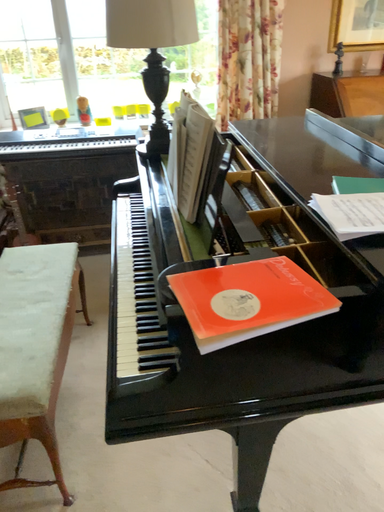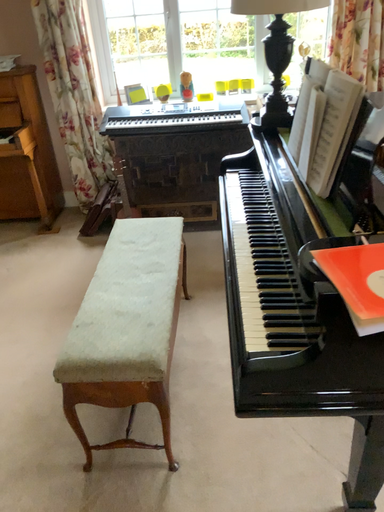
Question: Which way did the camera rotate in the video?

Choices:
 (A) rotated right
 (B) rotated left

Answer: (B)